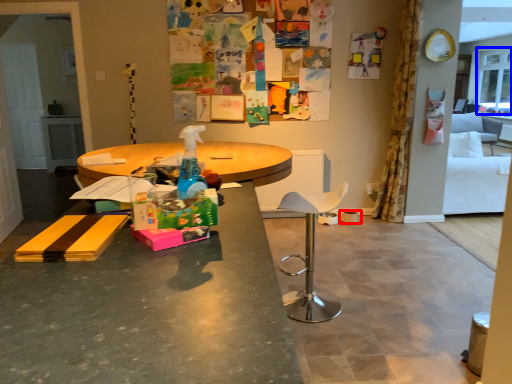
Question: Which of the following is the farthest to the observer, bowl (highlighted by a red box) or window screen (highlighted by a blue box)?

Choices:
 (A) bowl
 (B) window screen

Answer: (B)